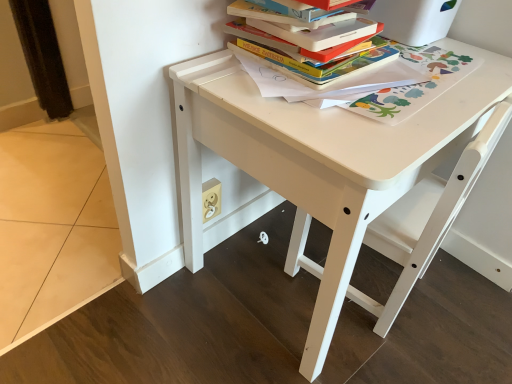
Identify the location of vacant space situated above white matte chair at center (from a real-world perspective). (424, 82).